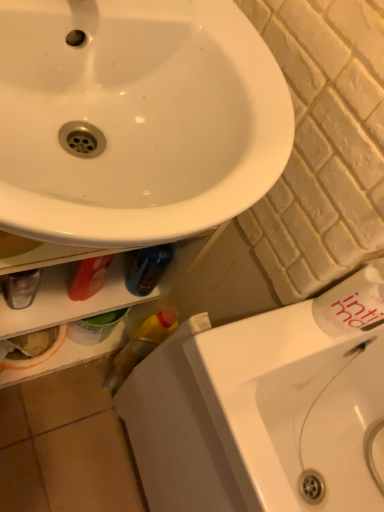
Question: Does point (253, 398) appear closer or farther from the camera than point (349, 297)?

Choices:
 (A) closer
 (B) farther

Answer: (B)

Question: Relative to white matte bottle at upper right, is white glossy sink at lower right in front or behind?

Choices:
 (A) front
 (B) behind

Answer: (A)

Question: Estimate the real-world distances between objects in this image. Which object is closer to the white glossy sink at upper left?

Choices:
 (A) white glossy sink at lower right
 (B) white textured brick at center right
 (C) white matte bottle at upper right

Answer: (B)

Question: Which of these objects is positioned closest to the white matte bottle at upper right?

Choices:
 (A) white textured brick at center right
 (B) white glossy sink at upper left
 (C) white glossy sink at lower right

Answer: (A)